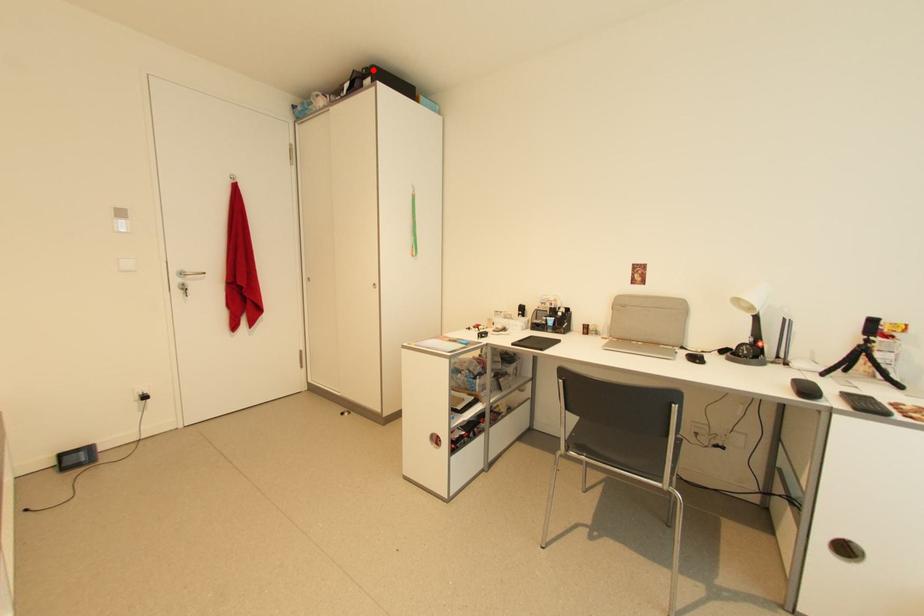
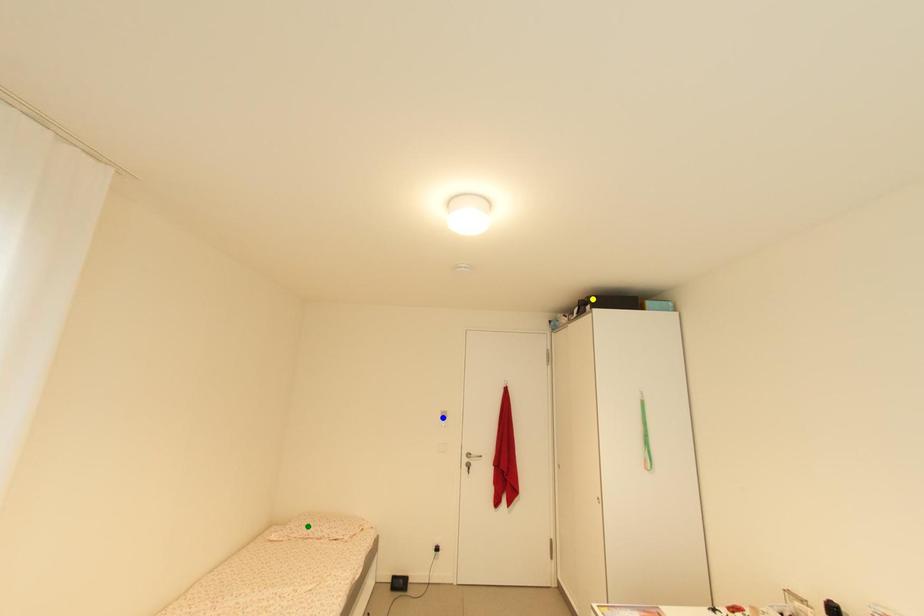
Question: I am providing you with two images of the same scene from different viewpoints. A red point is marked on the first image. You are given multiple points on the second image. Can you choose the point in image 2 that corresponds to the point in image 1?

Choices:
 (A) green point
 (B) yellow point
 (C) blue point

Answer: (B)